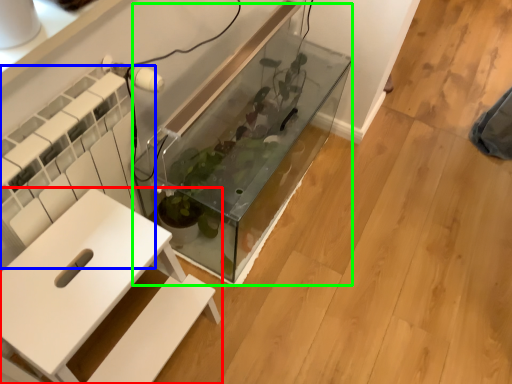
Question: Considering the real-world distances, which object is closest to furniture (highlighted by a red box)? radiator (highlighted by a blue box) or glass box (highlighted by a green box).

Choices:
 (A) radiator
 (B) glass box

Answer: (A)